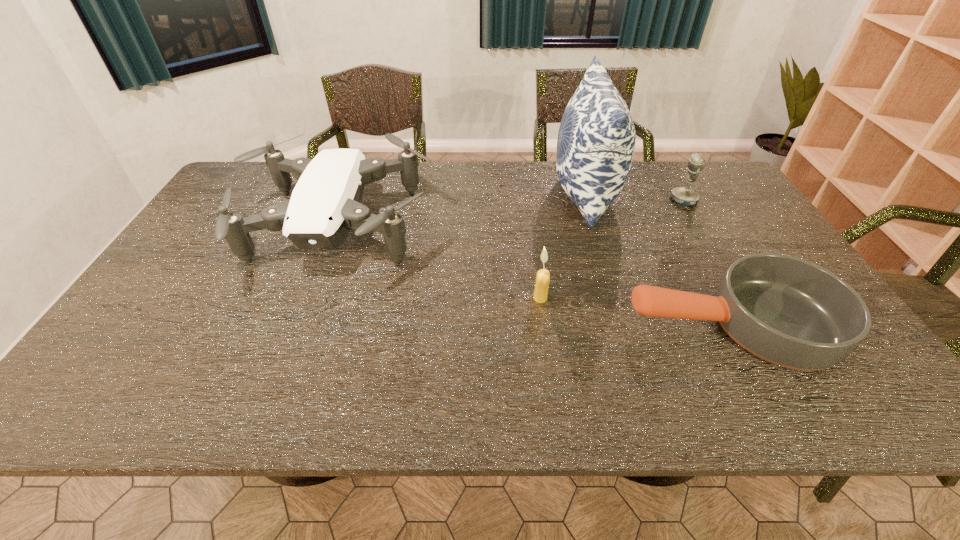
Locate an element on the screen. This screenshot has height=540, width=960. vacant point located on the front-facing side of the microphone is located at coordinates (611, 200).

Locate an element on the screen. This screenshot has width=960, height=540. free space located 0.330m on the front-facing side of the microphone is located at coordinates (566, 200).

You are a GUI agent. You are given a task and a screenshot of the screen. Output one action in this format:
    pyautogui.click(x=<x>, y=<y>)
    Task: Click on the vacant area situated 0.380m on the front-facing side of the microphone
    The height and width of the screenshot is (540, 960).
    Given the screenshot: What is the action you would take?
    pyautogui.click(x=551, y=200)

Identify the location of vacant space located on the handle side of the shortest object. Image resolution: width=960 pixels, height=540 pixels. (559, 323).

This screenshot has height=540, width=960. I want to click on vacant area situated 0.180m on the handle side of the shortest object, so click(x=550, y=323).

Identify the location of free point located 0.160m on the handle side of the shortest object. This screenshot has width=960, height=540. (559, 323).

Image resolution: width=960 pixels, height=540 pixels. I want to click on cushion located in the far edge section of the desktop, so 596,140.

Locate an element on the screen. drone that is at the far edge is located at coordinates (325, 205).

The image size is (960, 540). What are the coordinates of `microphone at the far edge` in the screenshot? It's located at (686, 196).

You are a GUI agent. You are given a task and a screenshot of the screen. Output one action in this format:
    pyautogui.click(x=<x>, y=<y>)
    Task: Click on the object present at the left edge
    The height and width of the screenshot is (540, 960).
    Given the screenshot: What is the action you would take?
    pyautogui.click(x=325, y=205)